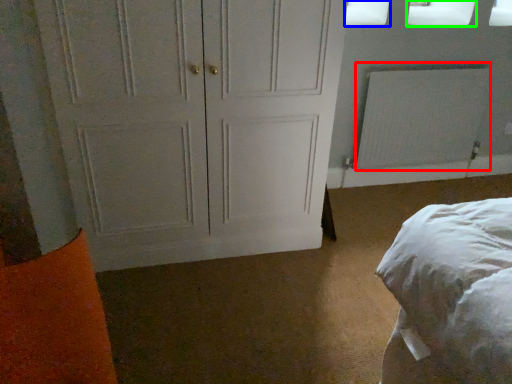
Question: Which object is the farthest from radiator (highlighted by a red box)? Choose among these: window screen (highlighted by a blue box) or window screen (highlighted by a green box).

Choices:
 (A) window screen
 (B) window screen

Answer: (A)